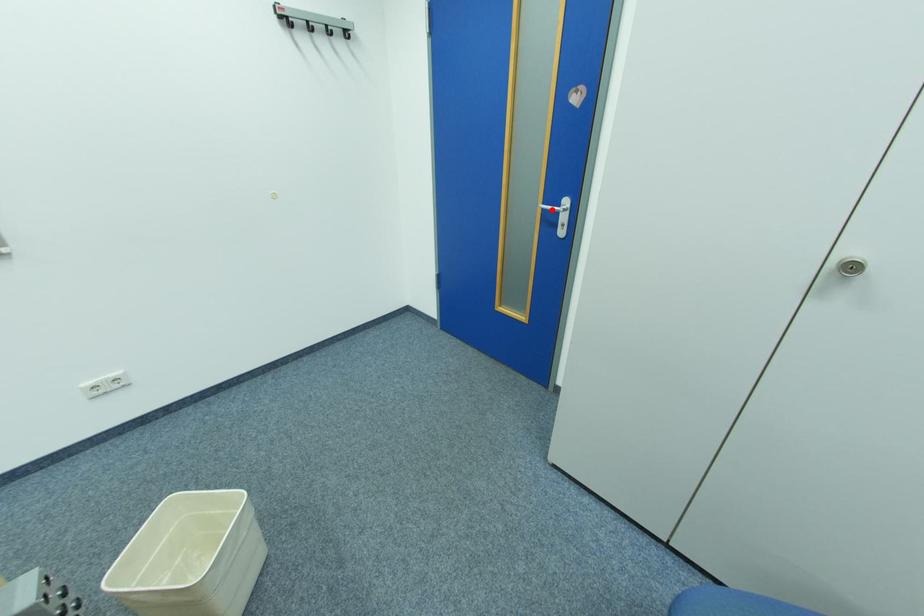
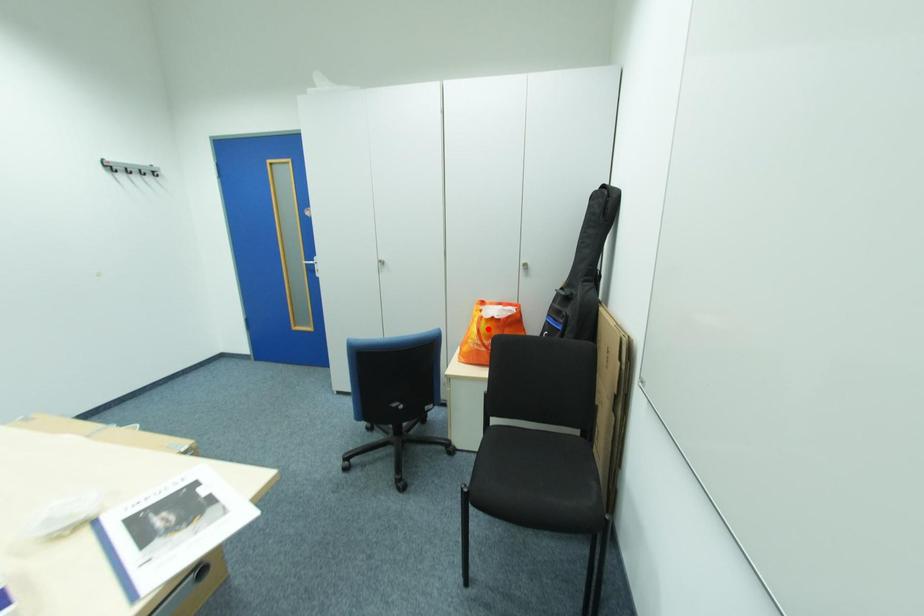
I am providing you with two images of the same scene from different viewpoints. A red point is marked on the first image and another point is marked on the second image. Are the points marked in image1 and image2 representing the same 3D position?

No